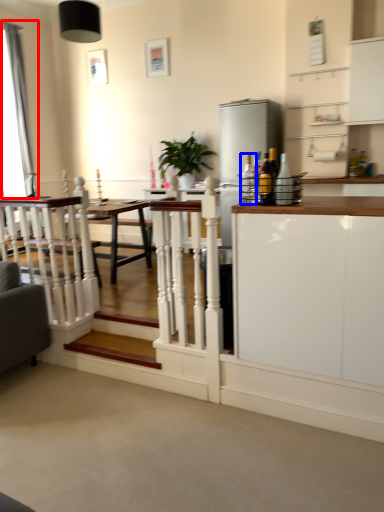
Question: Among these objects, which one is nearest to the camera, curtain (highlighted by a red box) or bottle (highlighted by a blue box)?

Choices:
 (A) curtain
 (B) bottle

Answer: (B)